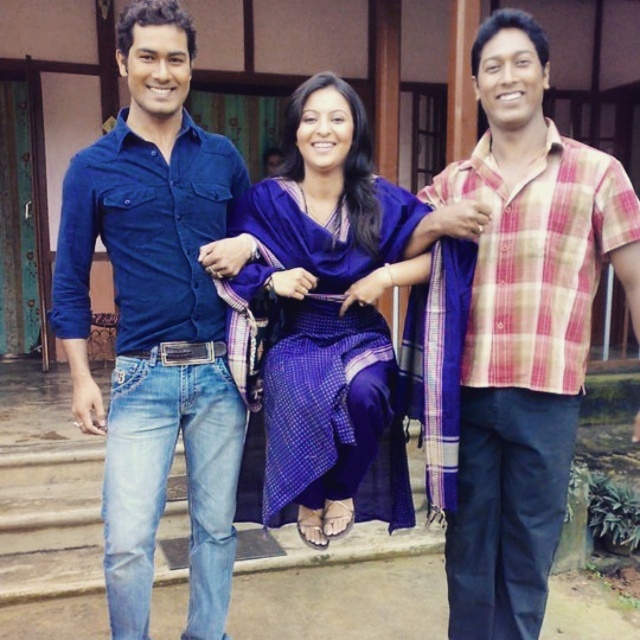
Consider the image. You are standing in the courtyard and want to approach both the denim jeans at left and the plaid cotton shirt at center. Which person should you walk towards first if you want to greet them before the other?

You should approach the denim jeans at left first because it is closer to you than the plaid cotton shirt at center, so you can greet them before moving further to the other person.

You are a fashion designer observing the three people in the courtyard. You notice the plaid cotton shirt at center and the black leather belt at center. Which clothing item is positioned lower on the person?

The plaid cotton shirt at center is located below the black leather belt at center, so the plaid cotton shirt at center is positioned lower.

You are a fashion designer observing the people in the courtyard. You notice the plaid cotton shirt at center and the black leather belt at center. Which clothing item is positioned higher on the person?

The plaid cotton shirt at center is much taller than the black leather belt at center, so the plaid cotton shirt at center is positioned higher on the person.